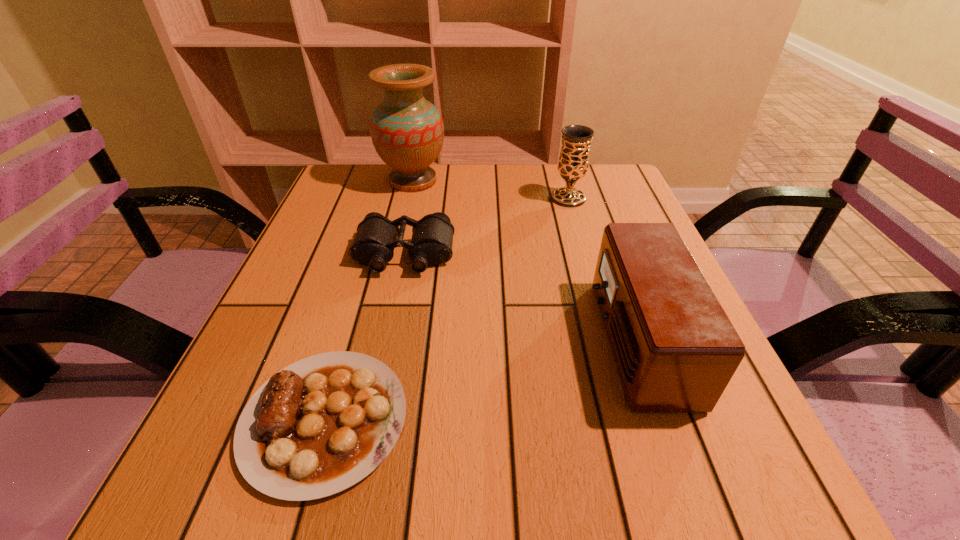
Find the location of a particular element. free spot between the third nearest object and the third shortest object is located at coordinates (521, 298).

Locate an element on the screen. This screenshot has height=540, width=960. free space between the tallest object and the third shortest object is located at coordinates (525, 260).

This screenshot has height=540, width=960. Find the location of `vacant area between the fourth shortest object and the vase`. vacant area between the fourth shortest object and the vase is located at coordinates (491, 190).

Image resolution: width=960 pixels, height=540 pixels. In order to click on vacant space that's between the third farthest object and the shortest object in this screenshot , I will do `click(365, 338)`.

Where is `vacant space that is in between the steak and the third shortest object`? The width and height of the screenshot is (960, 540). vacant space that is in between the steak and the third shortest object is located at coordinates (481, 380).

The width and height of the screenshot is (960, 540). Identify the location of blank region between the tallest object and the radio receiver. (525, 260).

You are a GUI agent. You are given a task and a screenshot of the screen. Output one action in this format:
    pyautogui.click(x=<x>, y=<y>)
    Task: Click on the free spot between the radio receiver and the steak
    Image resolution: width=960 pixels, height=540 pixels.
    Given the screenshot: What is the action you would take?
    pyautogui.click(x=481, y=380)

Find the location of a particular element. This screenshot has height=540, width=960. vacant space that is in between the radio receiver and the vase is located at coordinates (525, 260).

At what (x,y) coordinates should I click in order to perform the action: click on the fourth closest object to the radio receiver. Please return your answer as a coordinate pair (x, y). This screenshot has width=960, height=540. Looking at the image, I should click on (407, 131).

You are a GUI agent. You are given a task and a screenshot of the screen. Output one action in this format:
    pyautogui.click(x=<x>, y=<y>)
    Task: Click on the second closest object relative to the second shortest object
    This screenshot has width=960, height=540.
    Given the screenshot: What is the action you would take?
    pyautogui.click(x=322, y=424)